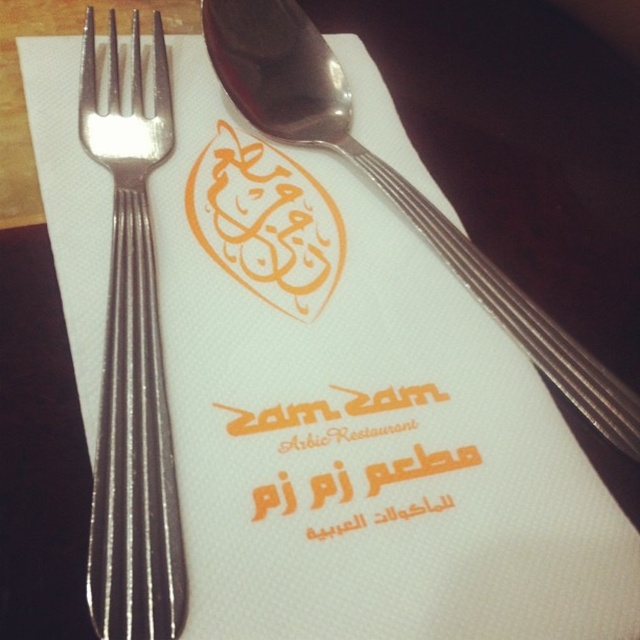
You are setting up a table for a formal dinner. You have a satin silver fork at left and a polished silver spoon at upper center. Which utensil should you place closer to the plate if you want the wider utensil to be farther from the plate?

The polished silver spoon at upper center is wider than the satin silver fork at left, so you should place the polished silver spoon at upper center farther from the plate to have the wider utensil farther away.

You are setting up a table for a customer and need to place a small bowl between the satin silver fork at left and the polished silver spoon at upper center. Based on their positions, where should you place the bowl so it is between them?

The satin silver fork at left is in front of the polished silver spoon at upper center, so placing the bowl between them would require positioning it in front of the spoon and behind the fork to maintain their spatial relationship.

You are a customer at the Arabic restaurant and want to write a note on the napkin. The napkin has the orange matte text at center and the polished silver spoon at upper center. Which object on the napkin has a smaller width?

The orange matte text at center has a lesser width compared to the polished silver spoon at upper center, so the orange matte text at center is smaller in width.